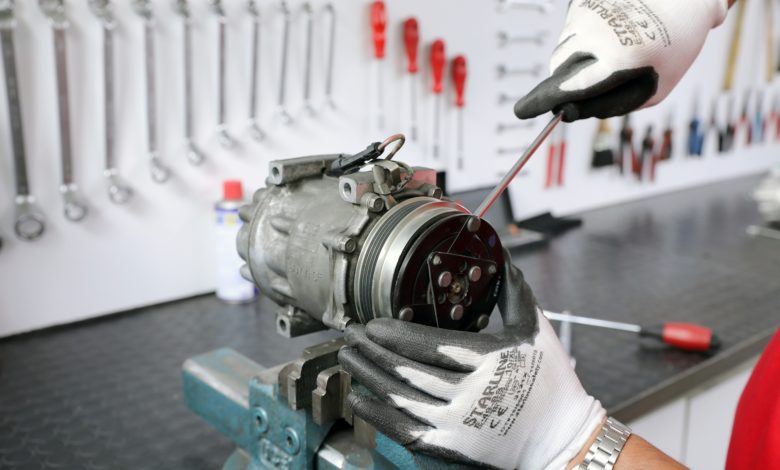
Where is `white panel that holds tools at back of counter`? The width and height of the screenshot is (780, 470). white panel that holds tools at back of counter is located at coordinates (144, 239).